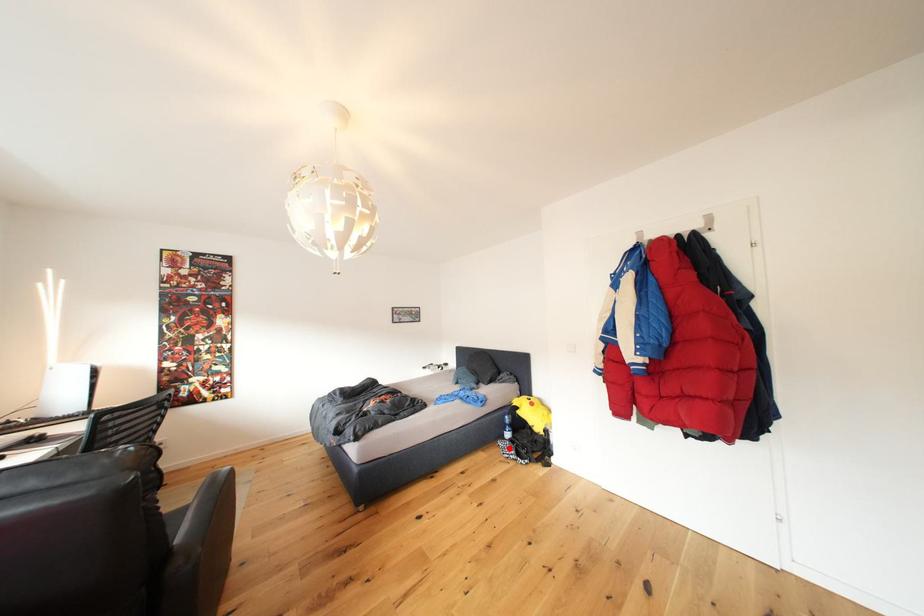
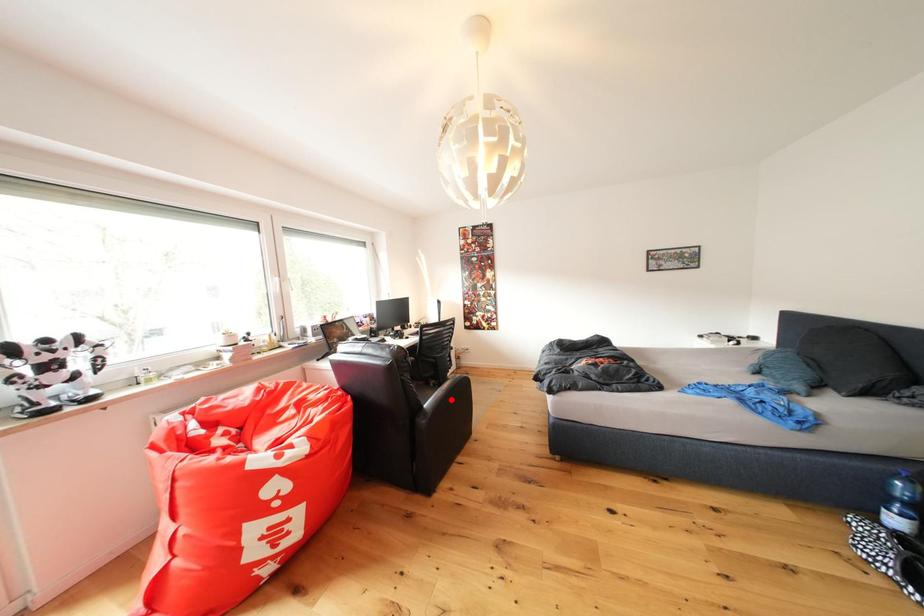
I am providing you with two images of the same scene from different viewpoints. A red point is marked on the first image and another point is marked on the second image. Is the red point in image1 aligned with the point shown in image2?

No